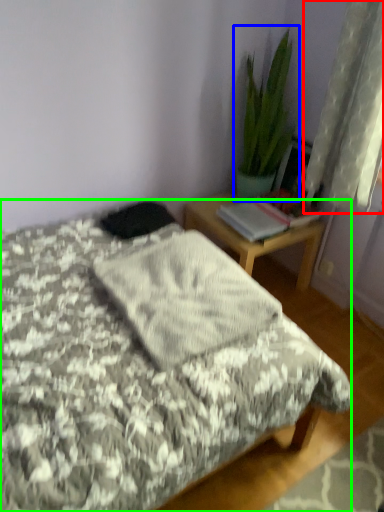
Question: Estimate the real-world distances between objects in this image. Which object is farther from curtain (highlighted by a red box), houseplant (highlighted by a blue box) or bed (highlighted by a green box)?

Choices:
 (A) houseplant
 (B) bed

Answer: (B)